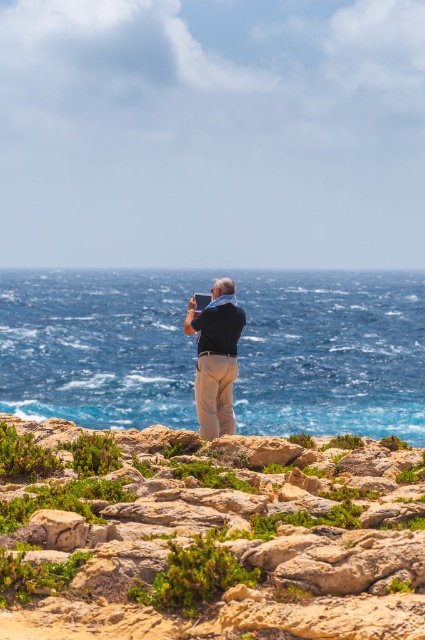
You are a hiker who wants to reach the rugged stone shoreline at center. You are currently standing at the point marked by the coordinates point (204, 538). Is the rugged stone shoreline at center located in front of you or behind you?

The point (204, 538) marks the rugged stone shoreline at center, so you are already standing on it.

You are a photographer trying to capture the rugged stone shoreline at center and the matte black shirt at center in a single frame. Based on their heights, which object will appear larger in the photo?

The rugged stone shoreline at center will appear larger in the photo since it is much taller than the matte black shirt at center.

You are standing on the rugged stone shoreline at center and want to reach the blue water at center. Which direction should you move to get to the water?

The rugged stone shoreline at center is positioned on the right side of blue water at center, so to reach the water, you should move to the left.